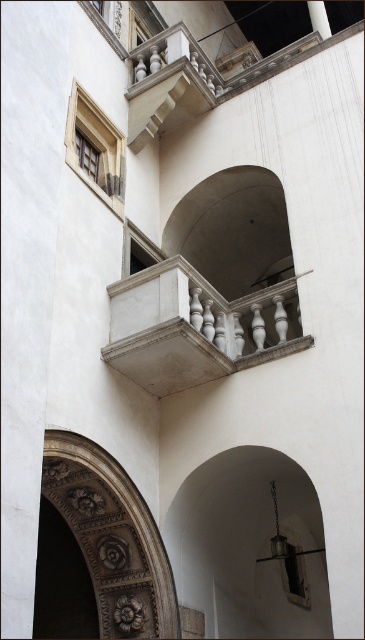
Question: Among these objects, which one is farthest from the camera?

Choices:
 (A) white marble balcony at center
 (B) carved stone archway at lower left

Answer: (A)

Question: Is white marble balcony at center thinner than carved stone archway at lower left?

Choices:
 (A) yes
 (B) no

Answer: (B)

Question: Is white marble balcony at center further to camera compared to carved stone archway at lower left?

Choices:
 (A) yes
 (B) no

Answer: (A)

Question: Can you confirm if white marble balcony at center is positioned below carved stone archway at lower left?

Choices:
 (A) no
 (B) yes

Answer: (A)